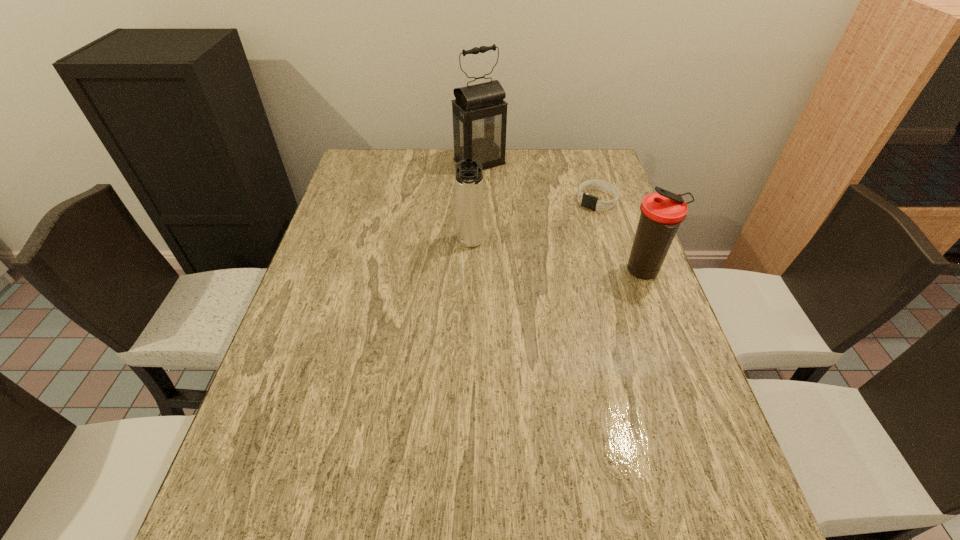
Locate an element on the screen. The width and height of the screenshot is (960, 540). free space that satisfies the following two spatial constraints: 1. on the handle side of the left thermos bottle; 2. on the left side of the right thermos bottle is located at coordinates click(x=469, y=272).

This screenshot has height=540, width=960. Find the location of `blank area in the image that satisfies the following two spatial constraints: 1. on the handle side of the right thermos bottle; 2. on the right side of the left thermos bottle`. blank area in the image that satisfies the following two spatial constraints: 1. on the handle side of the right thermos bottle; 2. on the right side of the left thermos bottle is located at coordinates (469, 272).

Locate an element on the screen. blank space that satisfies the following two spatial constraints: 1. on the handle side of the right thermos bottle; 2. on the right side of the left thermos bottle is located at coordinates (469, 272).